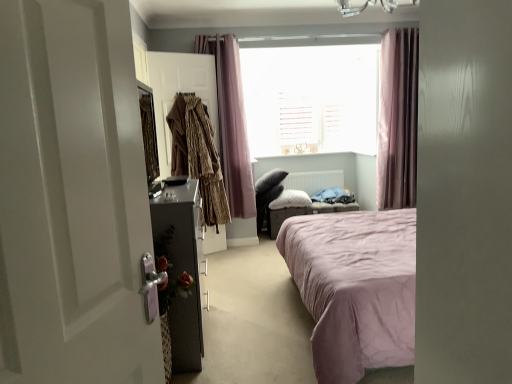
Question: From their relative heights in the image, would you say pink fabric ottoman at center is taller or shorter than white wooden blinds at center?

Choices:
 (A) tall
 (B) short

Answer: (B)

Question: Considering the positions of pink fabric ottoman at center and white wooden blinds at center in the image, is pink fabric ottoman at center wider or thinner than white wooden blinds at center?

Choices:
 (A) wide
 (B) thin

Answer: (A)

Question: Which of these objects is positioned closest to the metallic dark gray nightstand at left?

Choices:
 (A) pink fabric curtain at upper center, the 2th curtain viewed from the right
 (B) white matte radiator at center
 (C) pink fabric curtain at upper right, positioned as the 2th curtain in left-to-right order
 (D) pink fabric ottoman at center
 (E) leopard print coat at left, marked as the 2th clothing in a left-to-right arrangement

Answer: (E)

Question: Considering the real-world distances, which object is farthest from the pink fabric curtain at upper right, positioned as the 2th curtain in left-to-right order?

Choices:
 (A) white matte radiator at center
 (B) pink fabric curtain at upper center, the 2th curtain viewed from the right
 (C) white wooden blinds at center
 (D) metallic dark gray nightstand at left
 (E) brown textured coat at center, acting as the first clothing starting from the left

Answer: (D)